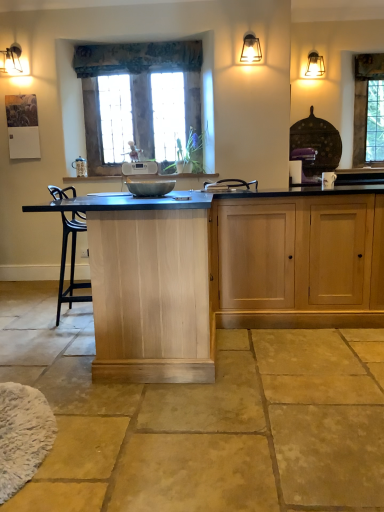
What is the approximate height of white fluffy mat at lower left?

white fluffy mat at lower left is 21.08 centimeters tall.

I want to click on natural wood cabinet at center, so click(x=150, y=287).

This screenshot has height=512, width=384. Describe the element at coordinates (299, 262) in the screenshot. I see `light wood cabinet at center` at that location.

Based on the photo, measure the distance between natural stone floor at center and camera.

The depth of natural stone floor at center is 4.44 feet.

What do you see at coordinates (251, 49) in the screenshot?
I see `matte black wall sconce at upper right` at bounding box center [251, 49].

Identify the location of wooden window at center, which ranks as the 2th window in back-to-front order. (140, 99).

At what (x,y) coordinates should I click in order to perform the action: click on white fluffy mat at lower left. Please return your answer as a coordinate pair (x, y). Looking at the image, I should click on (23, 435).

Is textured fabric curtain at upper center wider than white fluffy mat at lower left?

In fact, textured fabric curtain at upper center might be narrower than white fluffy mat at lower left.

Is textured fabric curtain at upper center located outside white fluffy mat at lower left?

textured fabric curtain at upper center lies outside white fluffy mat at lower left's area.

From the image's perspective, who appears lower, textured fabric curtain at upper center or white fluffy mat at lower left?

white fluffy mat at lower left.

From a real-world perspective, is textured fabric curtain at upper center under white fluffy mat at lower left?

No.

What are the coordinates of `mat in front of the metallic bowl at center` in the screenshot? It's located at (23, 435).

Is metallic bowl at center at the right side of white fluffy mat at lower left?

Yes, metallic bowl at center is to the right of white fluffy mat at lower left.

From a real-world perspective, between metallic bowl at center and white fluffy mat at lower left, who is vertically lower?

white fluffy mat at lower left, from a real-world perspective.

Does metallic bowl at center turn towards white fluffy mat at lower left?

No, metallic bowl at center is not facing towards white fluffy mat at lower left.

Is the position of wooden window at center, which is counted as the first window, starting from the front, more distant than that of light wood cabinet at center?

Yes, it is.

Is wooden window at center, the 1th window in the left-to-right sequence, spatially inside light wood cabinet at center, or outside of it?

wooden window at center, the 1th window in the left-to-right sequence, exists outside the volume of light wood cabinet at center.

Visually, is wooden window at center, which ranks as the 2th window in back-to-front order, positioned to the left or to the right of light wood cabinet at center?

Based on their positions, wooden window at center, which ranks as the 2th window in back-to-front order, is located to the left of light wood cabinet at center.

Considering the sizes of objects metallic bowl at center and matte black wall sconce at upper right in the image provided, who is taller, metallic bowl at center or matte black wall sconce at upper right?

matte black wall sconce at upper right is taller.

Looking at this image, is metallic bowl at center positioned beyond the bounds of matte black wall sconce at upper right?

metallic bowl at center lies outside matte black wall sconce at upper right's area.

Between metallic bowl at center and matte black wall sconce at upper right, which one has larger width?

metallic bowl at center.

Identify the location of light fixture above the metallic bowl at center (from a real-world perspective). (251, 49).

Can you confirm if metallic bowl at center is positioned to the right of clear glass window at upper right, marked as the 2th window in a front-to-back arrangement?

No.

Is point (169, 185) closer to viewer compared to point (383, 69)?

That is True.

The height and width of the screenshot is (512, 384). I want to click on window on the right side of metallic bowl at center, so click(x=364, y=100).

From a real-world perspective, is natural wood cabinet at center on top of textured fabric curtain at upper center?

Incorrect, from a real-world perspective, natural wood cabinet at center is lower than textured fabric curtain at upper center.

From the image's perspective, which object appears higher, natural wood cabinet at center or textured fabric curtain at upper center?

textured fabric curtain at upper center appears higher in the image.

Is natural wood cabinet at center positioned before textured fabric curtain at upper center?

Yes, it is.

Is natural wood cabinet at center bigger than textured fabric curtain at upper center?

Correct, natural wood cabinet at center is larger in size than textured fabric curtain at upper center.

Does white fluffy mat at lower left appear on the right side of metallic bowl at center?

Incorrect, white fluffy mat at lower left is not on the right side of metallic bowl at center.

Is the surface of white fluffy mat at lower left in direct contact with metallic bowl at center?

white fluffy mat at lower left and metallic bowl at center are not in contact.

Is white fluffy mat at lower left further to the viewer compared to metallic bowl at center?

No, it is in front of metallic bowl at center.

Find the location of a particular element. The image size is (384, 512). curtain that appears behind the white fluffy mat at lower left is located at coordinates (137, 58).

Where is `mat that is under the metallic bowl at center (from a real-world perspective)`? mat that is under the metallic bowl at center (from a real-world perspective) is located at coordinates (23, 435).

Based on the photo, estimate the real-world distances between objects in this image. Which object is closer to matte black wall sconce at upper right, white fluffy mat at lower left or light wood cabinet at center?

Among the two, light wood cabinet at center is located nearer to matte black wall sconce at upper right.

Looking at the image, which one is located further to wooden window at center, which is counted as the first window, starting from the front, natural stone floor at center or textured fabric curtain at upper center?

The object further to wooden window at center, which is counted as the first window, starting from the front, is natural stone floor at center.

Which object lies further to the anchor point natural wood cabinet at center, matte black wall sconce at upper right or textured fabric curtain at upper center?

The object further to natural wood cabinet at center is textured fabric curtain at upper center.

In the scene shown: When comparing their distances from clear glass window at upper right, the 1th window in the right-to-left sequence, does natural stone floor at center or light wood cabinet at center seem further?

natural stone floor at center.

Which object lies nearer to the anchor point textured fabric curtain at upper center, natural stone floor at center or wooden window at center, which appears as the second window when viewed from the right?

Among the two, wooden window at center, which appears as the second window when viewed from the right, is located nearer to textured fabric curtain at upper center.

From the picture: Which object lies nearer to the anchor point metallic bowl at center, natural stone floor at center or textured fabric curtain at upper center?

Among the two, textured fabric curtain at upper center is located nearer to metallic bowl at center.

Looking at this image, when comparing their distances from natural stone floor at center, does natural wood cabinet at center or wooden window at center, which ranks as the 2th window in back-to-front order, seem further?

Among the two, wooden window at center, which ranks as the 2th window in back-to-front order, is located further to natural stone floor at center.

Which object lies further to the anchor point matte black wall sconce at upper right, light wood cabinet at center or metallic bowl at center?

Based on the image, light wood cabinet at center appears to be further to matte black wall sconce at upper right.

Locate an element on the screen. concrete that lies between matte black wall sconce at upper right and white fluffy mat at lower left from top to bottom is located at coordinates (201, 419).

In order to click on cabinetry located between white fluffy mat at lower left and wooden window at center, which ranks as the 2th window in back-to-front order, in the depth direction in this screenshot , I will do `click(299, 262)`.

Where is `cabinetry between metallic bowl at center and clear glass window at upper right, marked as the 2th window in a front-to-back arrangement, from front to back`? Image resolution: width=384 pixels, height=512 pixels. cabinetry between metallic bowl at center and clear glass window at upper right, marked as the 2th window in a front-to-back arrangement, from front to back is located at coordinates (299, 262).

In order to click on cabinetry between metallic bowl at center and wooden window at center, the 1th window in the left-to-right sequence, in the front-back direction in this screenshot , I will do `click(299, 262)`.